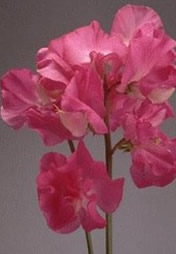
You are a GUI agent. You are given a task and a screenshot of the screen. Output one action in this format:
    pyautogui.click(x=<x>, y=<y>)
    Task: Click on the lightest grey wall in lower right
    This screenshot has width=176, height=254.
    Given the screenshot: What is the action you would take?
    pyautogui.click(x=147, y=243)